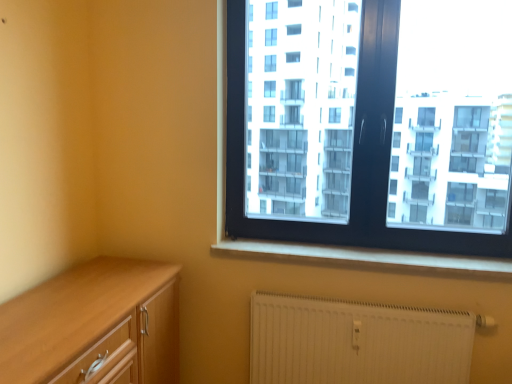
What is the approximate height of white smooth window sill at lower center?

white smooth window sill at lower center is 8.76 centimeters in height.

Find the location of a particular element. The image size is (512, 384). white smooth window sill at lower center is located at coordinates (365, 258).

This screenshot has height=384, width=512. What do you see at coordinates (371, 123) in the screenshot?
I see `black plastic window at upper right` at bounding box center [371, 123].

Image resolution: width=512 pixels, height=384 pixels. What do you see at coordinates (94, 326) in the screenshot?
I see `light wood cabinet at lower left` at bounding box center [94, 326].

Where is `white smooth window sill at lower center`? white smooth window sill at lower center is located at coordinates (365, 258).

How distant is black plastic window at upper right from light wood cabinet at lower left?

black plastic window at upper right and light wood cabinet at lower left are 1.03 meters apart from each other.

Can light wood cabinet at lower left be found inside black plastic window at upper right?

No, light wood cabinet at lower left is not inside black plastic window at upper right.

Between black plastic window at upper right and light wood cabinet at lower left, which one is positioned behind?

black plastic window at upper right is behind.

In terms of height, does black plastic window at upper right look taller or shorter compared to light wood cabinet at lower left?

In the image, black plastic window at upper right appears to be taller than light wood cabinet at lower left.

Can you see white textured radiator at lower right touching black plastic window at upper right?

No, white textured radiator at lower right is not with black plastic window at upper right.

Considering the relative sizes of white textured radiator at lower right and black plastic window at upper right in the image provided, is white textured radiator at lower right thinner than black plastic window at upper right?

Yes.

Looking at this image, can you confirm if white textured radiator at lower right is shorter than black plastic window at upper right?

Correct, white textured radiator at lower right is not as tall as black plastic window at upper right.

Could you tell me if white textured radiator at lower right is facing black plastic window at upper right?

No, white textured radiator at lower right is not oriented towards black plastic window at upper right.

Is the position of black plastic window at upper right more distant than that of white textured radiator at lower right?

No, black plastic window at upper right is closer to the viewer.

From the picture: Considering the relative positions of black plastic window at upper right and white textured radiator at lower right in the image provided, is black plastic window at upper right to the right of white textured radiator at lower right from the viewer's perspective?

Indeed, black plastic window at upper right is positioned on the right side of white textured radiator at lower right.

From a real-world perspective, does black plastic window at upper right sit lower than white textured radiator at lower right?

Incorrect, from a real-world perspective, black plastic window at upper right is higher than white textured radiator at lower right.

How different are the orientations of black plastic window at upper right and white textured radiator at lower right in degrees?

0.0856 degrees separate the facing orientations of black plastic window at upper right and white textured radiator at lower right.

Is light wood cabinet at lower left in front of or behind black plastic window at upper right in the image?

In the image, light wood cabinet at lower left appears in front of black plastic window at upper right.

Does light wood cabinet at lower left appear on the left side of black plastic window at upper right?

Yes.

Which of these two, light wood cabinet at lower left or black plastic window at upper right, stands shorter?

Standing shorter between the two is light wood cabinet at lower left.

How different are the orientations of light wood cabinet at lower left and black plastic window at upper right in degrees?

There is a 89.3-degree angle between the facing directions of light wood cabinet at lower left and black plastic window at upper right.

You are a GUI agent. You are given a task and a screenshot of the screen. Output one action in this format:
    pyautogui.click(x=<x>, y=<y>)
    Task: Click on the window sill above the white textured radiator at lower right (from a real-world perspective)
    The height and width of the screenshot is (384, 512).
    Given the screenshot: What is the action you would take?
    pyautogui.click(x=365, y=258)

How many degrees apart are the facing directions of white smooth window sill at lower center and white textured radiator at lower right?

The facing directions of white smooth window sill at lower center and white textured radiator at lower right are 0.674 degrees apart.

In the scene shown: Which point is more distant from viewer, (419, 261) or (435, 348)?

Positioned behind is point (419, 261).

From a real-world perspective, who is located lower, white smooth window sill at lower center or white textured radiator at lower right?

white textured radiator at lower right.

Is light wood cabinet at lower left far from white smooth window sill at lower center?

No.

How much distance is there between light wood cabinet at lower left and white smooth window sill at lower center?

A distance of 71.74 centimeters exists between light wood cabinet at lower left and white smooth window sill at lower center.

Is light wood cabinet at lower left positioned in front of white smooth window sill at lower center?

Yes, the depth of light wood cabinet at lower left is less than that of white smooth window sill at lower center.

Is point (66, 274) in front of point (510, 264)?

Yes, point (66, 274) is in front of point (510, 264).

How many degrees apart are the facing directions of white smooth window sill at lower center and light wood cabinet at lower left?

The angular difference between white smooth window sill at lower center and light wood cabinet at lower left is 89.9 degrees.

I want to click on window sill behind the light wood cabinet at lower left, so click(365, 258).

Is white smooth window sill at lower center facing towards light wood cabinet at lower left?

No, white smooth window sill at lower center is not turned towards light wood cabinet at lower left.

Are white smooth window sill at lower center and light wood cabinet at lower left far apart?

white smooth window sill at lower center is actually quite close to light wood cabinet at lower left.

Identify the location of cabinetry that appears below the black plastic window at upper right (from a real-world perspective). (94, 326).

The width and height of the screenshot is (512, 384). Identify the location of radiator that is behind the black plastic window at upper right. (356, 342).

Based on their spatial positions, is white smooth window sill at lower center or black plastic window at upper right further from light wood cabinet at lower left?

black plastic window at upper right.

Consider the image. When comparing their distances from black plastic window at upper right, does light wood cabinet at lower left or white textured radiator at lower right seem further?

light wood cabinet at lower left is further to black plastic window at upper right.

When comparing their distances from white smooth window sill at lower center, does light wood cabinet at lower left or black plastic window at upper right seem closer?

Based on the image, black plastic window at upper right appears to be nearer to white smooth window sill at lower center.

When comparing their distances from white smooth window sill at lower center, does white textured radiator at lower right or black plastic window at upper right seem closer?

white textured radiator at lower right lies closer to white smooth window sill at lower center than the other object.

From the picture: Based on their spatial positions, is black plastic window at upper right or light wood cabinet at lower left closer to white textured radiator at lower right?

Based on the image, black plastic window at upper right appears to be nearer to white textured radiator at lower right.

From the image, which object appears to be nearer to white smooth window sill at lower center, black plastic window at upper right or light wood cabinet at lower left?

black plastic window at upper right is positioned closer to the anchor white smooth window sill at lower center.

When comparing their distances from black plastic window at upper right, does white smooth window sill at lower center or white textured radiator at lower right seem closer?

white smooth window sill at lower center is closer to black plastic window at upper right.

Looking at the image, which one is located closer to white textured radiator at lower right, white smooth window sill at lower center or light wood cabinet at lower left?

The object closer to white textured radiator at lower right is white smooth window sill at lower center.

Locate an element on the screen. radiator situated between light wood cabinet at lower left and black plastic window at upper right from left to right is located at coordinates (356, 342).

Identify the location of window sill between light wood cabinet at lower left and white textured radiator at lower right in the horizontal direction. The width and height of the screenshot is (512, 384). (365, 258).

I want to click on window sill between black plastic window at upper right and white textured radiator at lower right from top to bottom, so click(365, 258).

Image resolution: width=512 pixels, height=384 pixels. What are the coordinates of `window sill between light wood cabinet at lower left and black plastic window at upper right` in the screenshot? It's located at (365, 258).